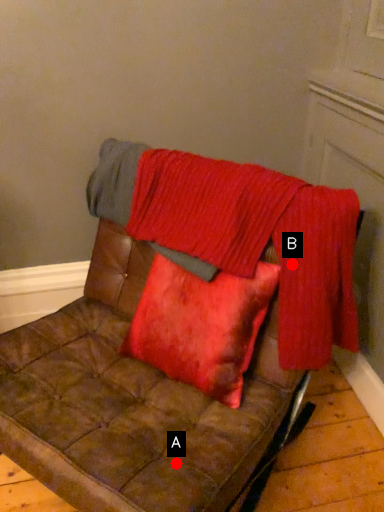
Question: Two points are circled on the image, labeled by A and B beside each circle. Which point appears farthest from the camera in this image?

Choices:
 (A) A is further
 (B) B is further

Answer: (B)